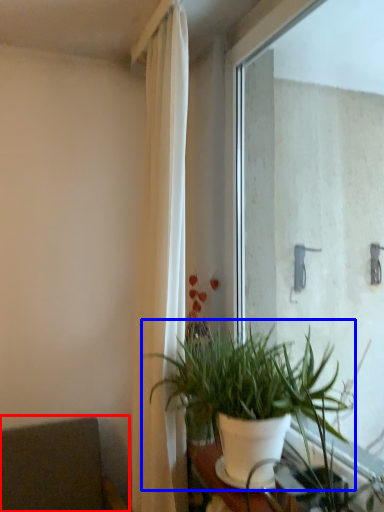
Question: Which of the following is the farthest to the observer, armchair (highlighted by a red box) or houseplant (highlighted by a blue box)?

Choices:
 (A) armchair
 (B) houseplant

Answer: (A)